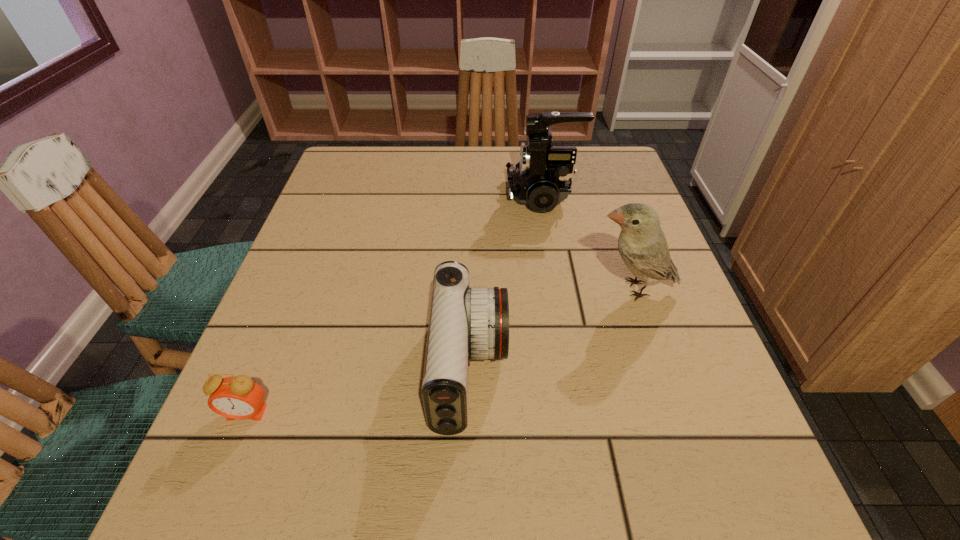
I want to click on free space located at the face of the third nearest object, so click(405, 289).

You are a GUI agent. You are given a task and a screenshot of the screen. Output one action in this format:
    pyautogui.click(x=<x>, y=<y>)
    Task: Click on the free space located at the face of the third nearest object
    Image resolution: width=960 pixels, height=540 pixels.
    Given the screenshot: What is the action you would take?
    pyautogui.click(x=549, y=289)

Identify the location of vacant space located at the face of the third nearest object. The height and width of the screenshot is (540, 960). (474, 289).

Where is `free spot located on the surface of the third object from right to left`? Image resolution: width=960 pixels, height=540 pixels. free spot located on the surface of the third object from right to left is located at coordinates (583, 370).

Locate an element on the screen. vacant region located on the face of the shortest object is located at coordinates (230, 454).

Identify the location of object that is at the far edge. This screenshot has width=960, height=540. (542, 179).

Find the location of a particular element. This screenshot has height=540, width=960. object that is at the left edge is located at coordinates (239, 397).

Find the location of a particular element. The height and width of the screenshot is (540, 960). camcorder that is at the right edge is located at coordinates (542, 179).

You are a GUI agent. You are given a task and a screenshot of the screen. Output one action in this format:
    pyautogui.click(x=<x>, y=<y>)
    Task: Click on the bird at the right edge
    
    Given the screenshot: What is the action you would take?
    pyautogui.click(x=642, y=245)

Image resolution: width=960 pixels, height=540 pixels. Find the location of `object at the far right corner`. object at the far right corner is located at coordinates (542, 179).